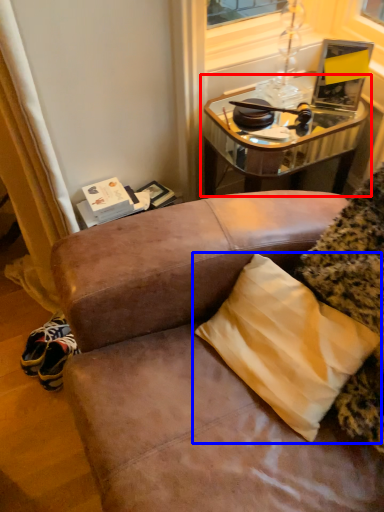
Question: Among these objects, which one is farthest to the camera, table (highlighted by a red box) or pillow (highlighted by a blue box)?

Choices:
 (A) table
 (B) pillow

Answer: (A)